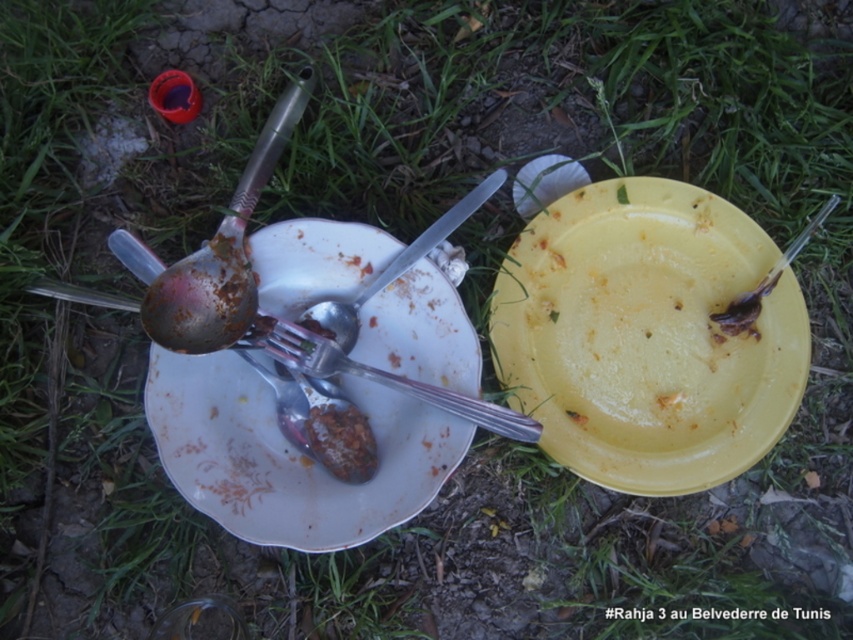
You are a park ranger trying to clean up the area. You see the brown matte food at center. Where exactly is it located in terms of coordinates?

The brown matte food at center is located at coordinates point (341,440).

You are organizing a picnic cleanup and need to place the yellow plastic plate at center and the silver metallic fork at center into separate recycling bins. The fork bin is on your left, and the plate bin is on your right. Based on their positions in the image, which object should you pick up first to minimize backtracking?

You should pick up the silver metallic fork at center first because it is positioned to the left of the yellow plastic plate at center, aligning with the fork bin location on your left. This way, you can move from left to right without needing to backtrack.